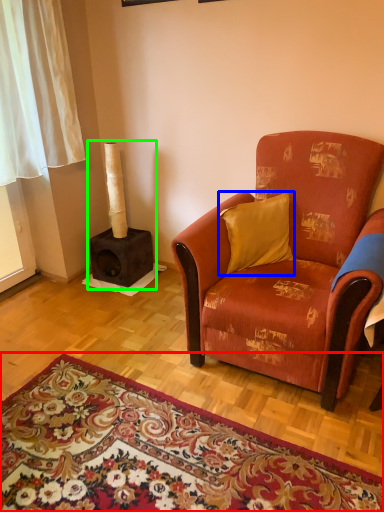
Question: Which is farther away from mat (highlighted by a red box)? pillow (highlighted by a blue box) or fireplace (highlighted by a green box)?

Choices:
 (A) pillow
 (B) fireplace

Answer: (B)